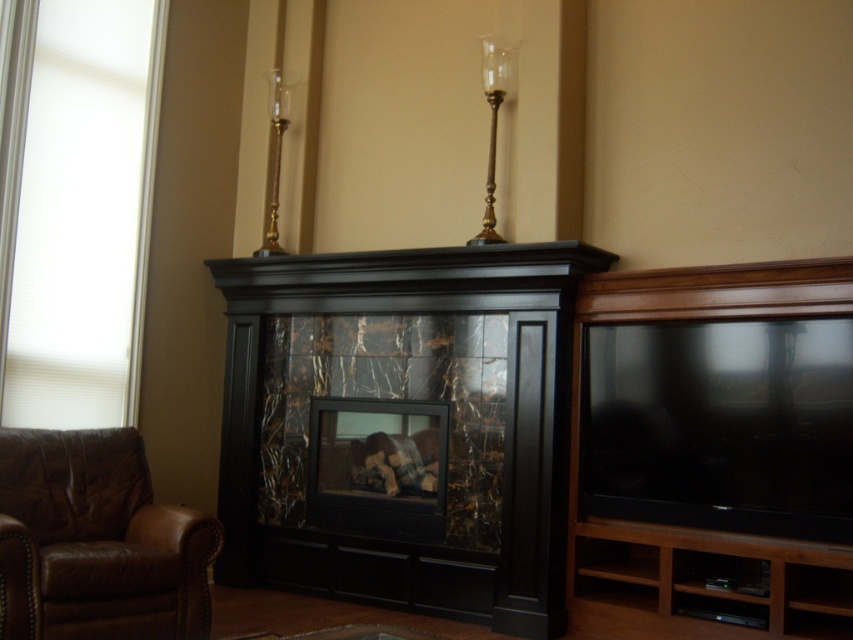
Can you confirm if black marble fireplace at center is positioned above brown leather armchair at lower left?

Yes.

Which is behind, point (408, 516) or point (26, 589)?

Positioned behind is point (408, 516).

This screenshot has width=853, height=640. What are the coordinates of `black marble fireplace at center` in the screenshot? It's located at (402, 419).